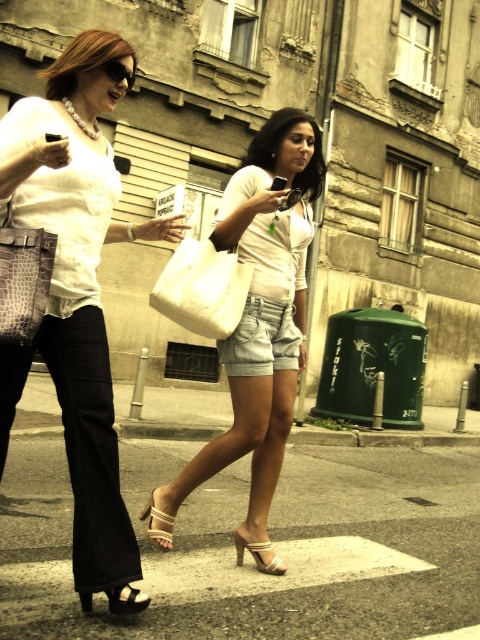
You are a photographer trying to capture a candid shot of the two women walking across the street. You want to ensure the denim shorts at center are in the frame. Based on their current position, where should you aim your camera to include both women in the shot?

The denim shorts at center are located at point (262, 340), so aiming the camera at that coordinate will ensure both women are captured in the frame.

You are a photographer trying to capture a candid shot of the two women walking across the street. You notice two points of interest marked at coordinates point (268, 365) and point (109, 61). Based on their positions relative to the camera, which point should you focus on to ensure the subject in that area is in sharper focus?

Point (268, 365) should be focused on because it is closer to the camera compared to point (109, 61), making it easier to achieve sharp focus there.